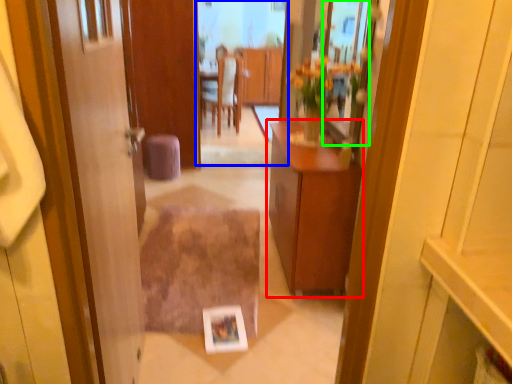
Question: Based on their relative distances, which object is farther from cabinetry (highlighted by a red box)? Choose from mirror (highlighted by a blue box) and mirror (highlighted by a green box).

Choices:
 (A) mirror
 (B) mirror

Answer: (A)